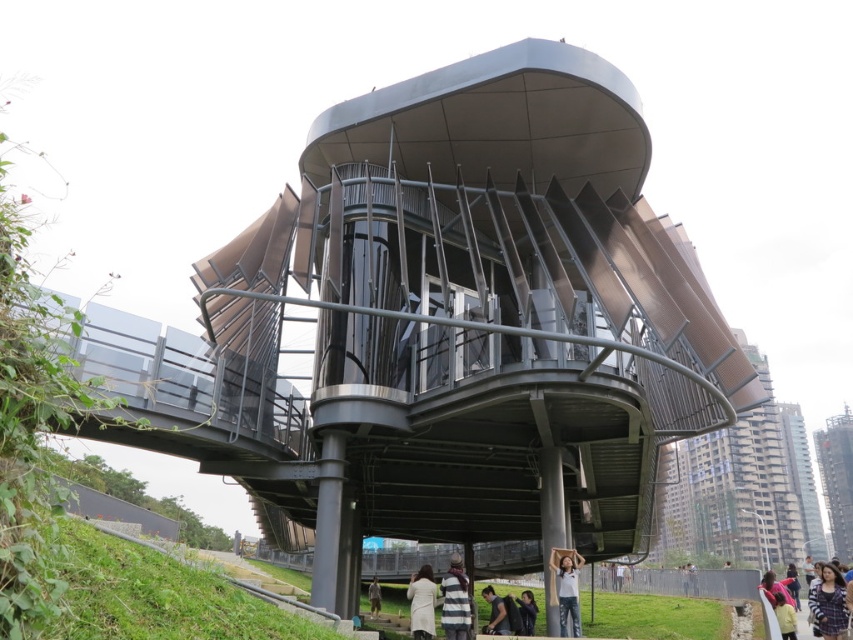
Who is taller, denim pants at lower center or dark brown hair at lower center?

Standing taller between the two is dark brown hair at lower center.

Which is more to the right, denim pants at lower center or dark brown hair at lower center?

From the viewer's perspective, dark brown hair at lower center appears more on the right side.

Image resolution: width=853 pixels, height=640 pixels. I want to click on denim pants at lower center, so click(567, 589).

Who is lower down, denim pants at lower center or beige fabric coat at lower center?

beige fabric coat at lower center is below.

Does denim pants at lower center have a greater height compared to beige fabric coat at lower center?

Correct, denim pants at lower center is much taller as beige fabric coat at lower center.

Where is `denim pants at lower center`? denim pants at lower center is located at coordinates pos(567,589).

Locate an element on the screen. The height and width of the screenshot is (640, 853). denim pants at lower center is located at coordinates (567, 589).

Between point (837, 632) and point (370, 592), which one is positioned in front?

Point (837, 632) is more forward.

Can you confirm if plaid shirt at lower right is bigger than light brown leather jacket at lower center?

Yes.

Is point (816, 621) farther from camera compared to point (372, 580)?

No, (816, 621) is in front of (372, 580).

This screenshot has height=640, width=853. I want to click on plaid shirt at lower right, so click(x=828, y=604).